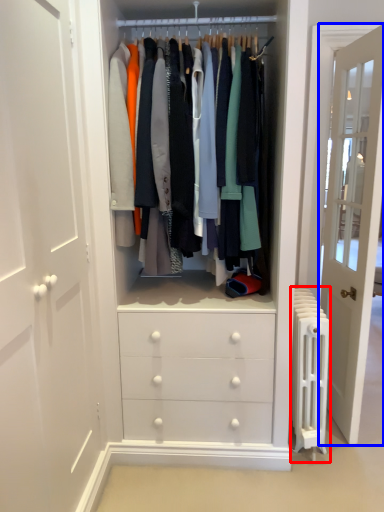
Question: Which point is closer to the camera, radiator (highlighted by a red box) or door (highlighted by a blue box)?

Choices:
 (A) radiator
 (B) door

Answer: (A)